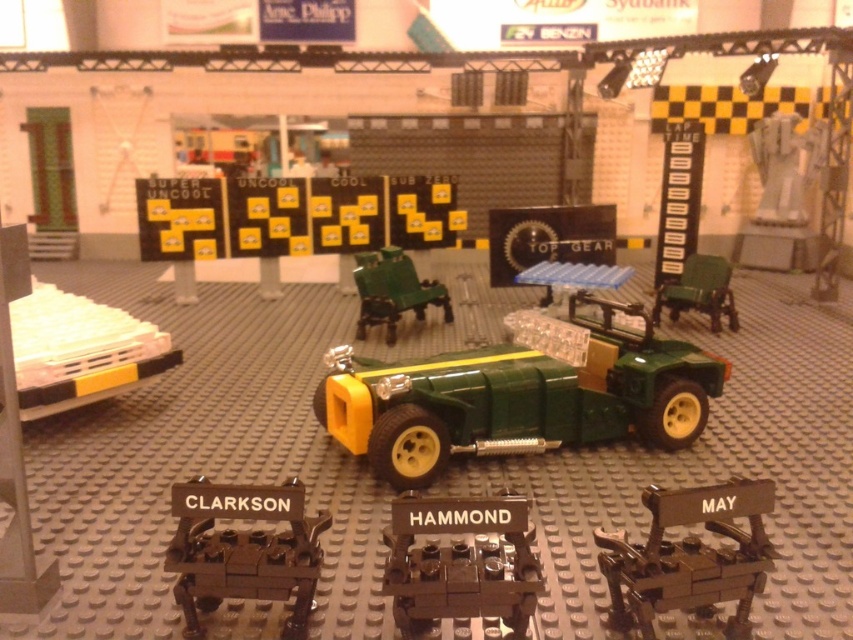
Can you confirm if dark brown metallic engine at lower center is shorter than metallic black engine at lower center?

Correct, dark brown metallic engine at lower center is not as tall as metallic black engine at lower center.

Does dark brown metallic engine at lower center have a lesser width compared to metallic black engine at lower center?

No.

Is point (426, 596) positioned before point (225, 563)?

Yes, point (426, 596) is closer to viewer.

I want to click on dark brown metallic engine at lower center, so click(461, 561).

Between point (473, 497) and point (363, 321), which one is positioned in front?

Point (473, 497) is in front.

Who is lower down, dark brown metallic engine at lower center or green plastic chairs at center?

dark brown metallic engine at lower center is below.

Is point (454, 552) in front of point (405, 289)?

Yes.

Locate an element on the screen. dark brown metallic engine at lower center is located at coordinates (461, 561).

Does metallic black engine at lower center appear under white plastic toy at lower left?

Yes.

Between metallic black engine at lower center and white plastic toy at lower left, which one is positioned higher?

white plastic toy at lower left

Where is `metallic black engine at lower center`? metallic black engine at lower center is located at coordinates (242, 548).